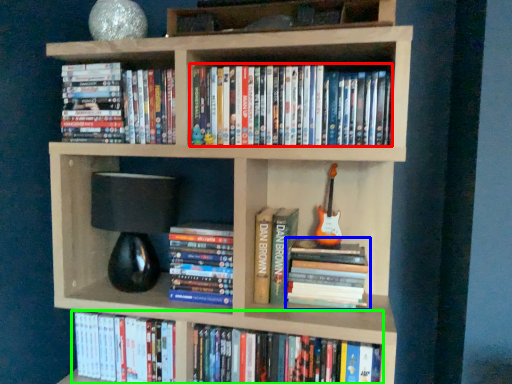
Question: Estimate the real-world distances between objects in this image. Which object is closer to book (highlighted by a red box), book (highlighted by a blue box) or book (highlighted by a green box)?

Choices:
 (A) book
 (B) book

Answer: (A)